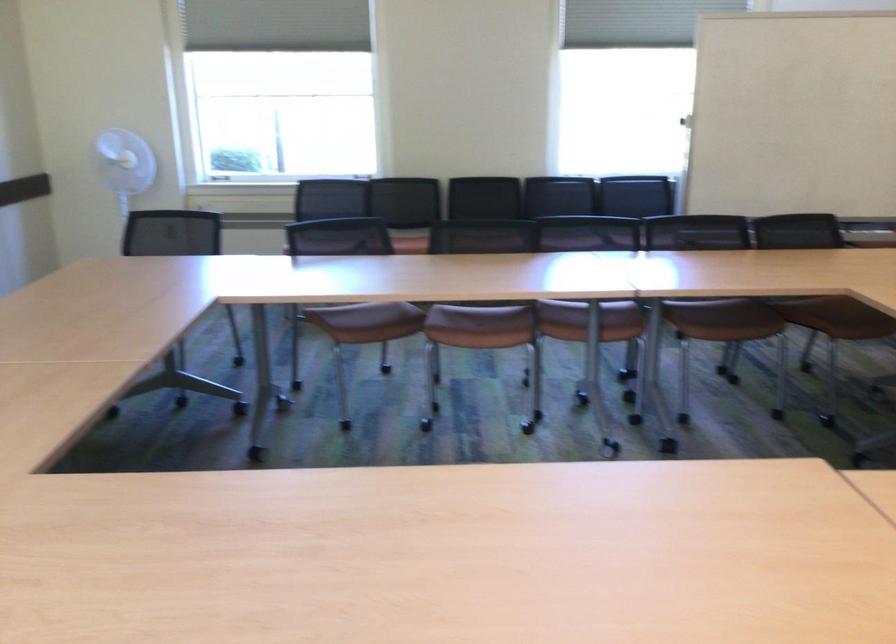
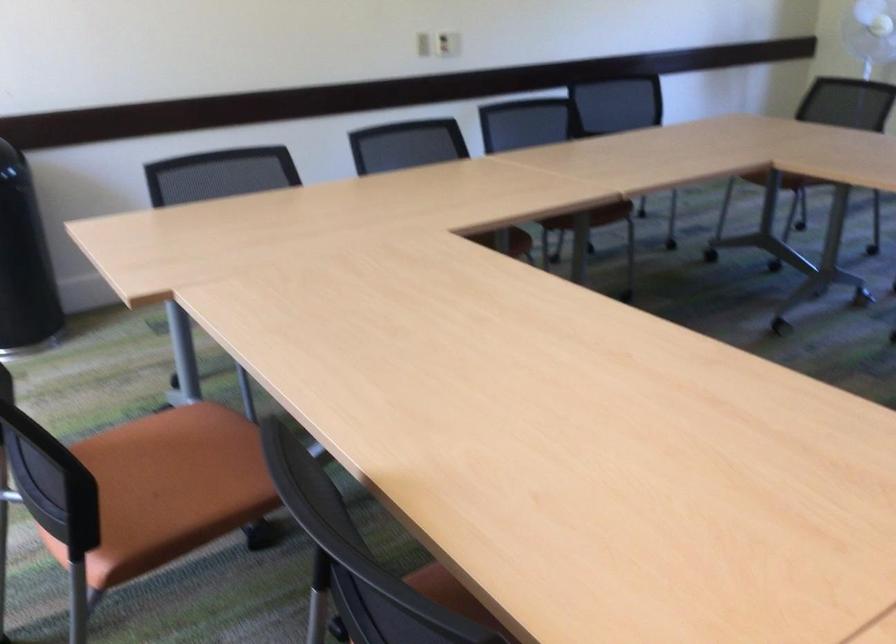
Question: The camera is either moving clockwise (left) or counter-clockwise (right) around the object. The first image is from the beginning of the video and the second image is from the end. Is the camera moving left or right when shooting the video?

Choices:
 (A) Left
 (B) Right

Answer: (B)